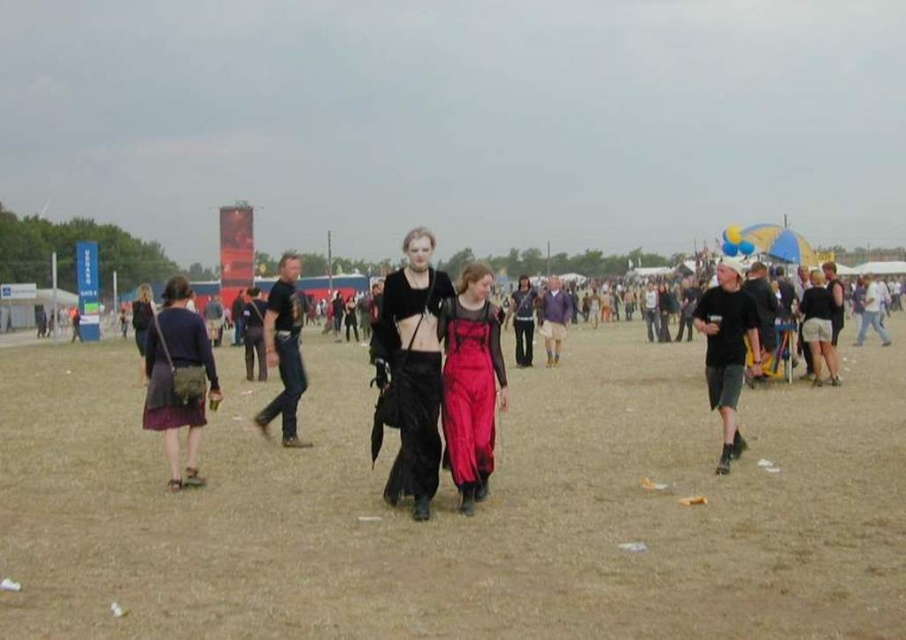
Question: Considering the relative positions of dark purple fabric dress at left and black leather pants at center in the image provided, where is dark purple fabric dress at left located with respect to black leather pants at center?

Choices:
 (A) right
 (B) left

Answer: (A)

Question: Which object is closer to the camera taking this photo?

Choices:
 (A) black matte shorts at right
 (B) satin dress at center

Answer: (B)

Question: Is dark purple fabric dress at left below black leather pants at center?

Choices:
 (A) no
 (B) yes

Answer: (A)

Question: Which of these objects is positioned farthest from the velvet black dress at center?

Choices:
 (A) matte purple skirt at lower left
 (B) satin dress at center
 (C) brown sandy ground at center

Answer: (C)

Question: Can you confirm if matte purple skirt at lower left is positioned to the right of black leather pants at center?

Choices:
 (A) no
 (B) yes

Answer: (A)

Question: Estimate the real-world distances between objects in this image. Which object is closer to the satin dress at center?

Choices:
 (A) brown sandy ground at center
 (B) black leather pants at center

Answer: (A)